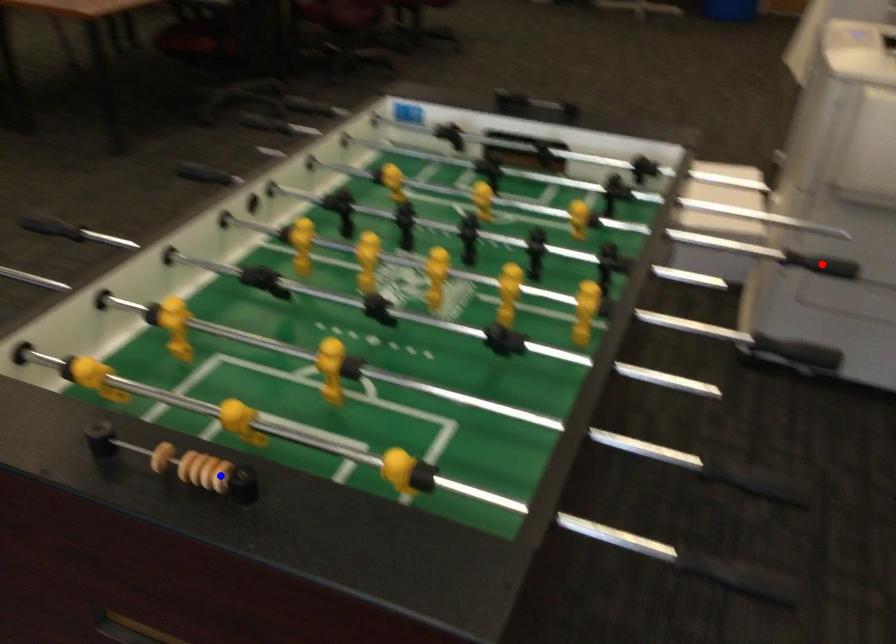
Question: In the image, two points are highlighted. Which point is nearer to the camera? Reply with the corresponding letter.

Choices:
 (A) blue point
 (B) red point

Answer: (A)